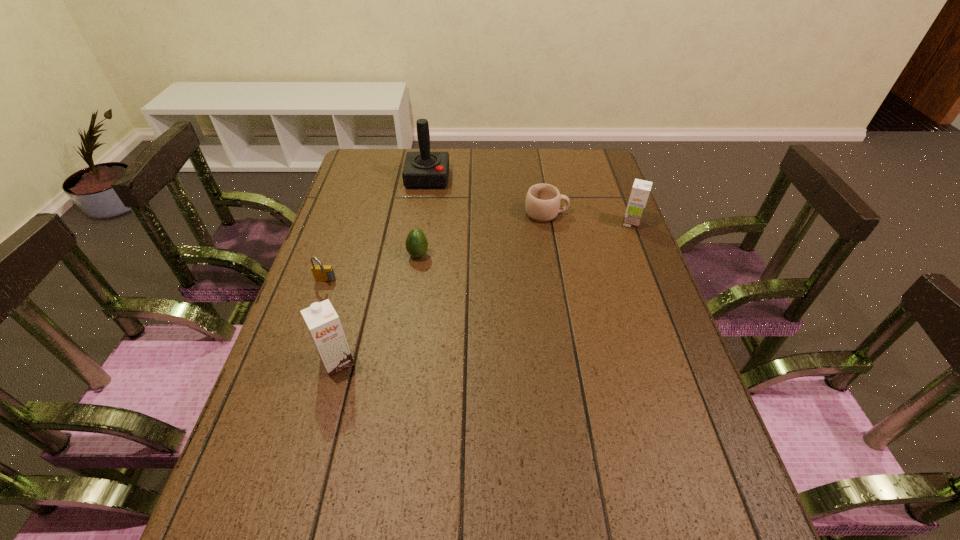
To make them evenly spaced by inserting another chocolate_milk among them, please locate a free space for this new chocolate_milk. Please provide its 2D coordinates. Your answer should be formatted as a tuple, i.e. [(x, y)], where the tuple contains the x and y coordinates of a point satisfying the conditions above.

[(507, 282)]